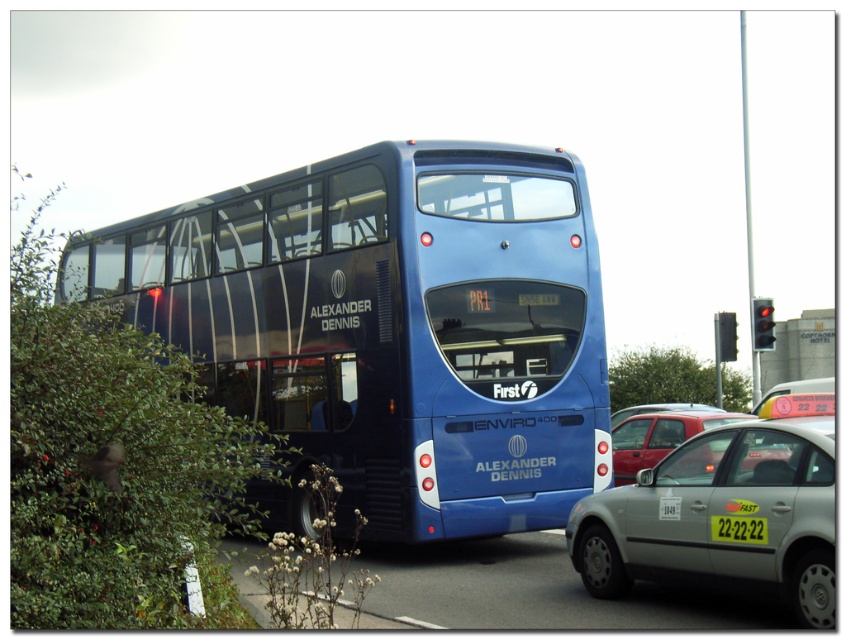
Question: Does blue metallic bus at center appear on the left side of silver metallic car at center?

Choices:
 (A) no
 (B) yes

Answer: (B)

Question: Can you confirm if blue metallic bus at center is positioned below matte red car at center?

Choices:
 (A) no
 (B) yes

Answer: (A)

Question: Can you confirm if metallic silver car at center is thinner than matte red car at center?

Choices:
 (A) no
 (B) yes

Answer: (B)

Question: Estimate the real-world distances between objects in this image. Which object is closer to the metallic silver car at center?

Choices:
 (A) silver metallic car at center
 (B) green plastic license plate at center
 (C) blue metallic bus at center

Answer: (C)

Question: Which object is the farthest from the metallic silver car at center?

Choices:
 (A) blue metallic bus at center
 (B) silver metallic car at center

Answer: (B)

Question: Among these points, which one is farthest from the camera?

Choices:
 (A) (443, 497)
 (B) (657, 408)
 (C) (662, 452)
 (D) (717, 529)

Answer: (B)